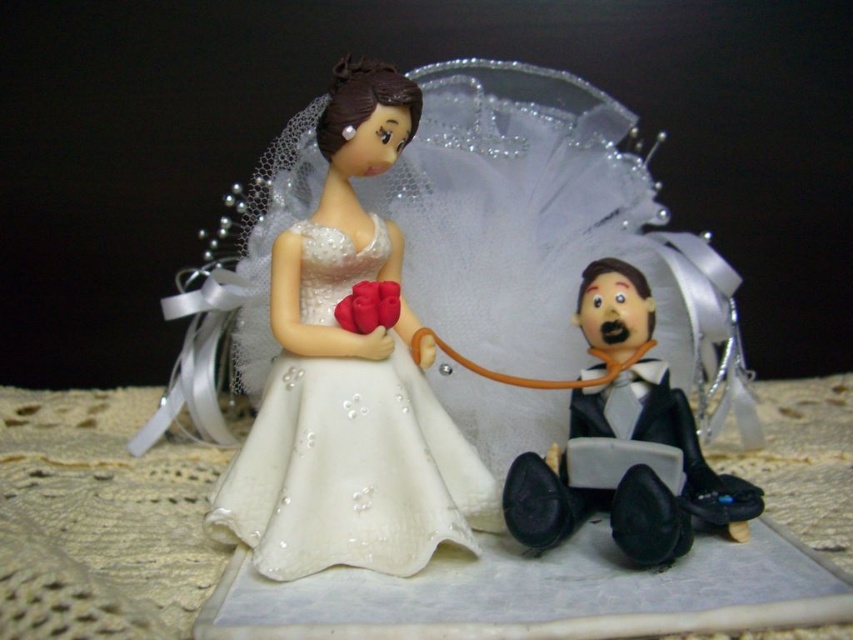
Can you confirm if satin white dress at upper left is thinner than black glossy suit at lower right?

No.

Can you confirm if satin white dress at upper left is wider than black glossy suit at lower right?

Yes.

Is point (294, 294) in front of point (676, 506)?

No, (294, 294) is further to viewer.

Where is `satin white dress at upper left`? This screenshot has height=640, width=853. satin white dress at upper left is located at coordinates (350, 380).